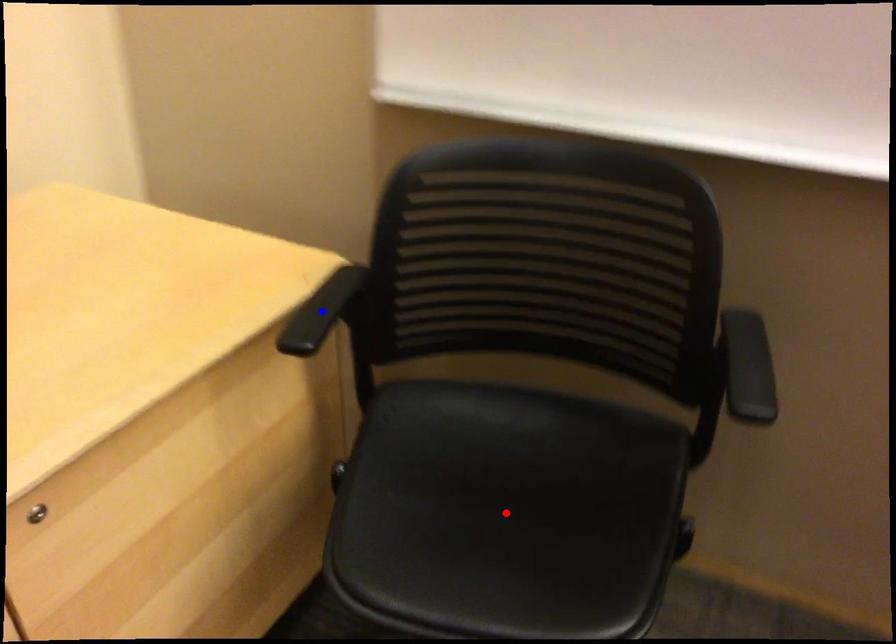
Question: In the image, two points are highlighted. Which point is nearer to the camera? Reply with the corresponding letter.

Choices:
 (A) blue point
 (B) red point

Answer: (B)